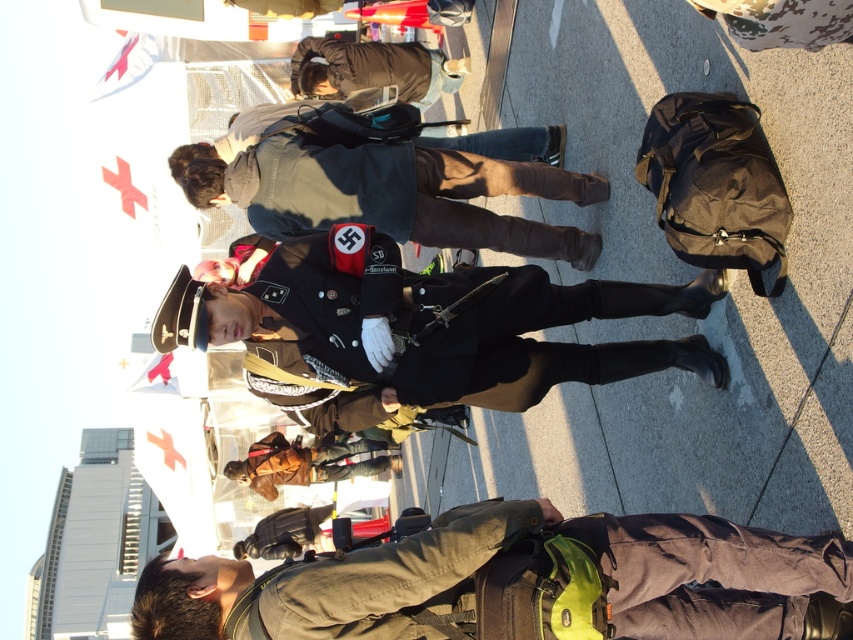
Question: Which point is closer to the camera?

Choices:
 (A) dark brown leather jacket at upper center
 (B) shiny black uniform at center
 (C) brown fabric backpack at lower center
 (D) brown leather jacket at center

Answer: (C)

Question: Which object appears closest to the camera in this image?

Choices:
 (A) brown leather jacket at center
 (B) dark brown leather jacket at upper center

Answer: (B)

Question: Is brown fabric backpack at lower center positioned behind dark gray fabric jacket at center?

Choices:
 (A) yes
 (B) no

Answer: (B)

Question: Can you confirm if brown fabric backpack at lower center is bigger than brown leather jacket at center?

Choices:
 (A) no
 (B) yes

Answer: (A)

Question: Which point is farther from the camera taking this photo?

Choices:
 (A) (581, 186)
 (B) (612, 516)
 (C) (357, 464)
 (D) (436, 67)

Answer: (C)

Question: Does dark brown leather jacket at upper center have a smaller size compared to brown leather jacket at center?

Choices:
 (A) yes
 (B) no

Answer: (A)